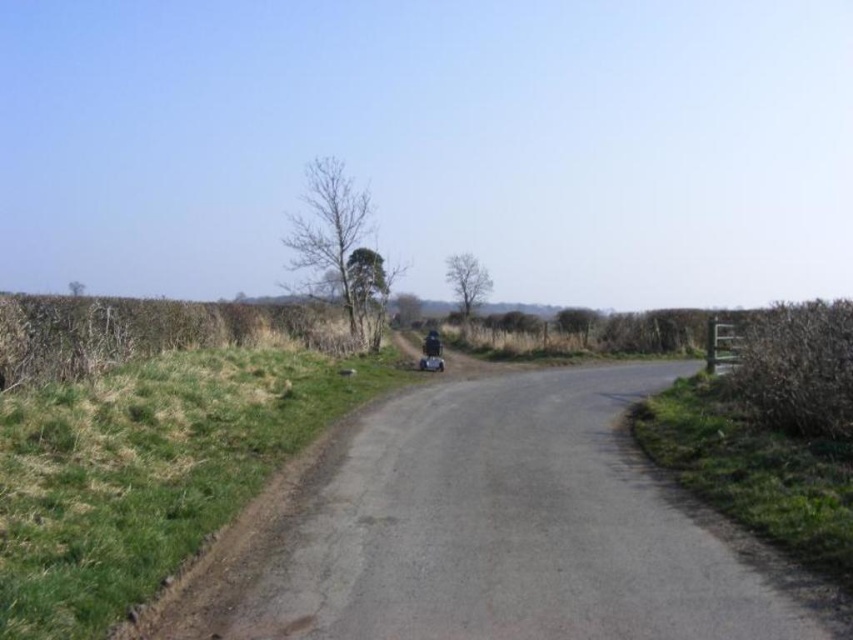
Can you confirm if brown dry hedge at left is wider than shiny black helmet at center?

Correct, the width of brown dry hedge at left exceeds that of shiny black helmet at center.

Between point (265, 340) and point (433, 348), which one is positioned in front?

Point (265, 340) is more forward.

In order to click on brown dry hedge at left in this screenshot , I will do `click(144, 332)`.

Is brown dry hedge at left wider than brown textured hedge at right?

Yes, brown dry hedge at left is wider than brown textured hedge at right.

Between brown dry hedge at left and brown textured hedge at right, which one has less height?

Standing shorter between the two is brown textured hedge at right.

This screenshot has height=640, width=853. In order to click on brown dry hedge at left in this screenshot , I will do pos(144,332).

Image resolution: width=853 pixels, height=640 pixels. Find the location of `brown dry hedge at left`. brown dry hedge at left is located at coordinates tap(144, 332).

Can you confirm if asphalt road at center is taller than brown dry hedge at left?

In fact, asphalt road at center may be shorter than brown dry hedge at left.

Between point (645, 589) and point (126, 326), which one is positioned behind?

Positioned behind is point (126, 326).

Find the location of `asphalt road at center`. asphalt road at center is located at coordinates click(x=495, y=531).